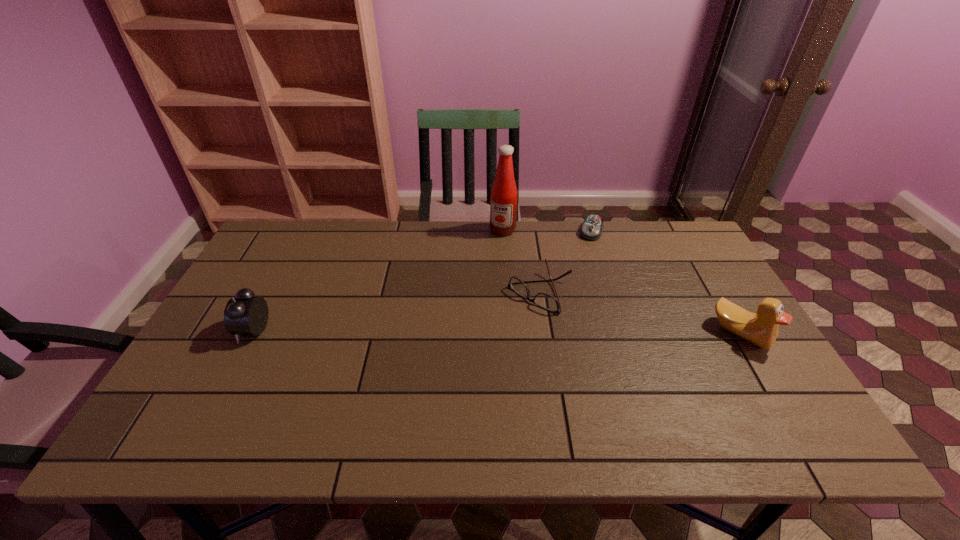
At what (x,y) coordinates should I click in order to perform the action: click on vacant space on the desktop that is between the alarm clock and the rightmost object and is positioned on the front-facing side of the condiment. Please return your answer as a coordinate pair (x, y). Image resolution: width=960 pixels, height=540 pixels. Looking at the image, I should click on (448, 331).

Find the location of `vacant space on the desktop that is between the leftmost object and the duck and is positioned on the wheel side of the shortest object`. vacant space on the desktop that is between the leftmost object and the duck and is positioned on the wheel side of the shortest object is located at coordinates (555, 332).

The image size is (960, 540). Find the location of `free space on the desktop that is between the alarm clock and the duck and is positioned on the front-facing side of the spectacles`. free space on the desktop that is between the alarm clock and the duck and is positioned on the front-facing side of the spectacles is located at coordinates (497, 331).